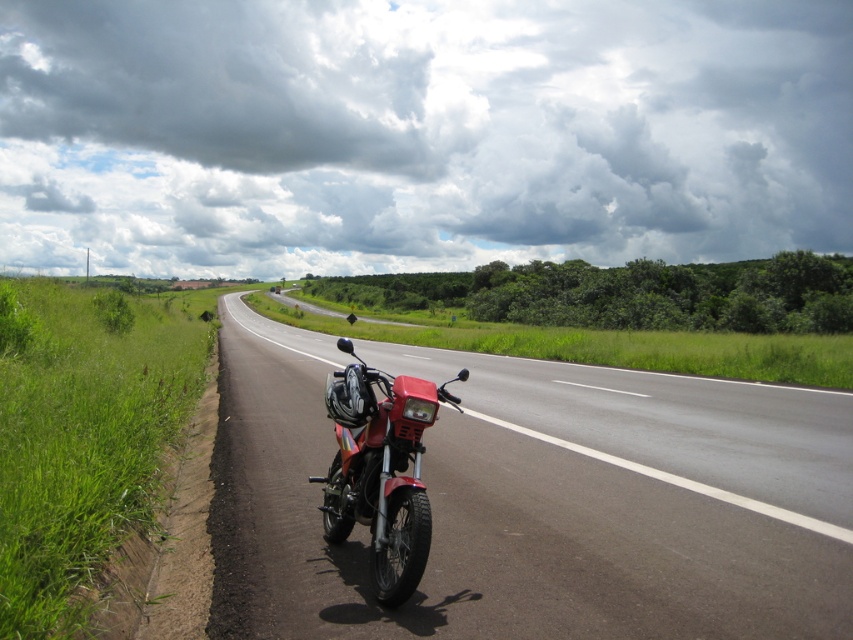
Question: Can you confirm if smooth asphalt highway at center is positioned below green grass at left?

Choices:
 (A) yes
 (B) no

Answer: (A)

Question: Which point is farther to the camera?

Choices:
 (A) metallic red motorcycle at center
 (B) smooth asphalt highway at center

Answer: (B)

Question: Among these objects, which one is farthest from the camera?

Choices:
 (A) green grass at left
 (B) smooth asphalt highway at center

Answer: (B)

Question: Can you confirm if green grass at left is positioned to the left of metallic red motorcycle at center?

Choices:
 (A) no
 (B) yes

Answer: (B)

Question: Among these objects, which one is farthest from the camera?

Choices:
 (A) metallic red motorcycle at center
 (B) smooth asphalt highway at center

Answer: (B)

Question: Can you confirm if green grass at left is positioned above metallic red motorcycle at center?

Choices:
 (A) yes
 (B) no

Answer: (A)